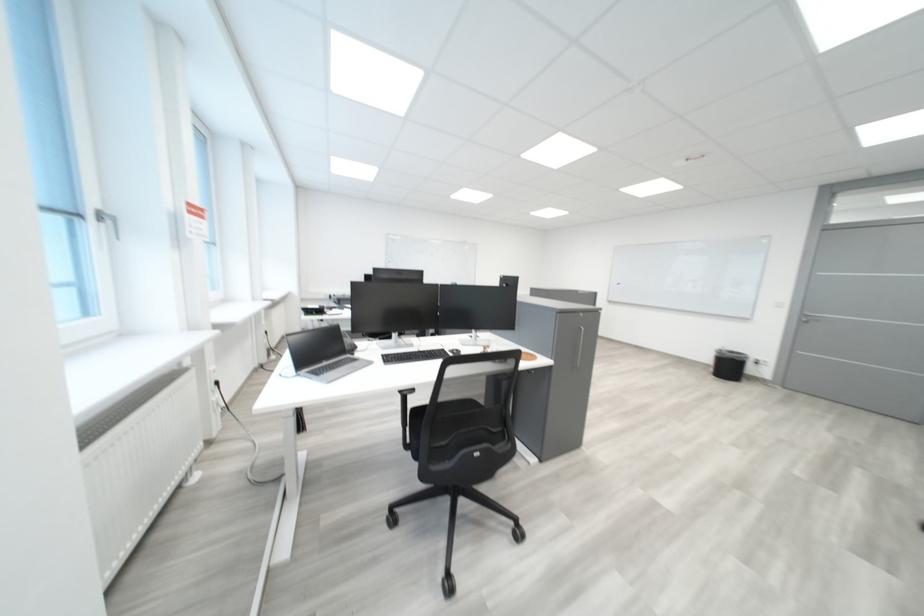
You are a GUI agent. You are given a task and a screenshot of the screen. Output one action in this format:
    pyautogui.click(x=<x>, y=<y>)
    Task: Click on the white window handle
    Image resolution: width=924 pixels, height=616 pixels.
    Given the screenshot: What is the action you would take?
    tap(114, 225)